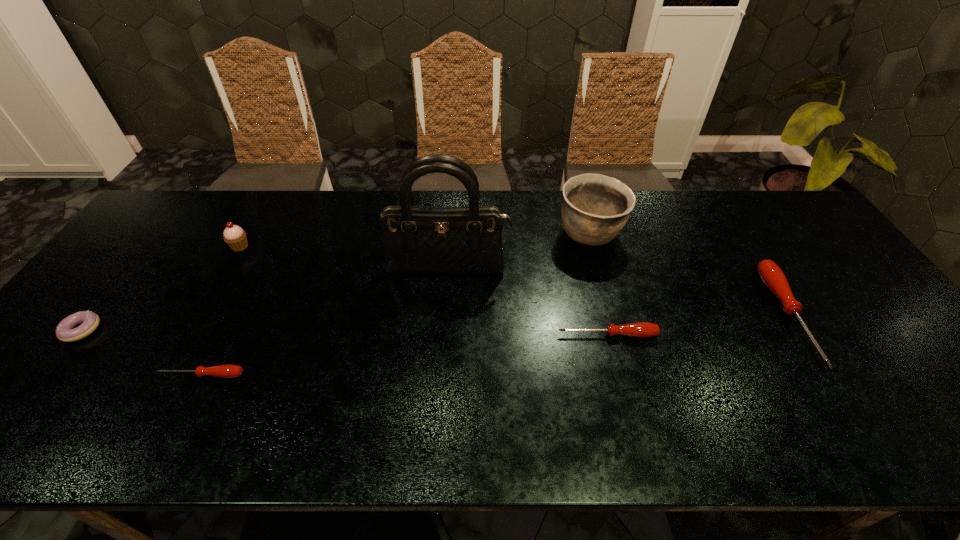
Locate an element on the screen. This screenshot has height=540, width=960. free space at the near edge of the desktop is located at coordinates (612, 401).

You are a GUI agent. You are given a task and a screenshot of the screen. Output one action in this format:
    pyautogui.click(x=<x>, y=<y>)
    Task: Click on the free space at the left edge
    Image resolution: width=960 pixels, height=540 pixels.
    Given the screenshot: What is the action you would take?
    pyautogui.click(x=124, y=310)

Locate an element on the screen. vacant area between the pottery and the tallest object is located at coordinates (519, 252).

Find the location of a particular element. This screenshot has height=540, width=960. free space between the second tallest object and the leftmost screwdriver is located at coordinates (396, 305).

Where is `vacant region between the cupcake and the second shortest screwdriver`? The height and width of the screenshot is (540, 960). vacant region between the cupcake and the second shortest screwdriver is located at coordinates (423, 291).

Locate an element on the screen. The image size is (960, 540). vacant region between the pottery and the second shortest screwdriver is located at coordinates (599, 285).

Locate an element on the screen. The image size is (960, 540). free space between the leftmost screwdriver and the fourth object from left to right is located at coordinates (324, 322).

Locate an element on the screen. The height and width of the screenshot is (540, 960). vacant region between the cupcake and the handbag is located at coordinates (344, 258).

The height and width of the screenshot is (540, 960). I want to click on free space between the fifth shortest object and the doughnut, so click(161, 288).

This screenshot has height=540, width=960. Identify the location of free space that is in between the tallest object and the fourth tallest object. (618, 293).